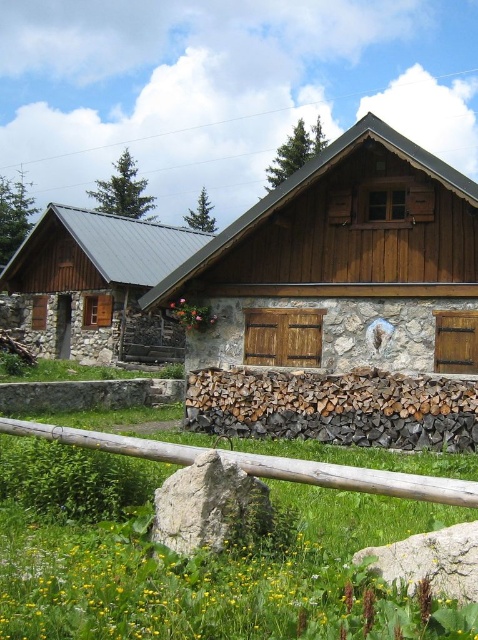
Question: Which of the following is the closest to the observer?

Choices:
 (A) gray rough rock at center
 (B) brown wooden fence at lower center
 (C) gray rough rock at lower center

Answer: (C)

Question: Is brown wooden fence at lower center smaller than gray rough rock at center?

Choices:
 (A) yes
 (B) no

Answer: (A)

Question: Does green grass at center have a lesser width compared to gray rough rock at center?

Choices:
 (A) no
 (B) yes

Answer: (A)

Question: Which object is farther from the camera taking this photo?

Choices:
 (A) brown wooden fence at lower center
 (B) gray rough rock at center
 (C) green grass at center
 (D) stone cabin at left

Answer: (D)

Question: Among these points, which one is nearest to the camera?

Choices:
 (A) (208, 509)
 (B) (434, 282)

Answer: (A)

Question: Can you confirm if wooden cabin at center is bigger than gray rough rock at center?

Choices:
 (A) yes
 (B) no

Answer: (A)